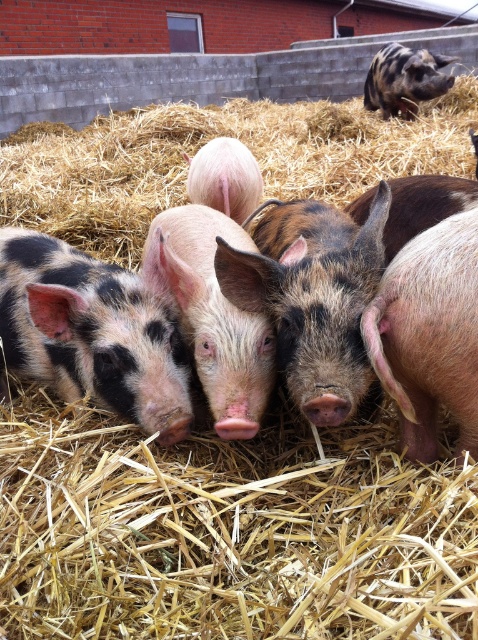
Question: Based on their relative distances, which object is nearer to the speckled pink pig at center?

Choices:
 (A) golden straw at center
 (B) pink soft skin at right

Answer: (B)

Question: Which object is farther from the camera taking this photo?

Choices:
 (A) speckled pink pig at center
 (B) pink soft skin pig at center
 (C) spotted fur piglet at center
 (D) pink soft skin at right

Answer: (C)

Question: Is speckled pink pig at center behind pink matte pig at center?

Choices:
 (A) yes
 (B) no

Answer: (B)

Question: Which object is positioned farthest from the golden straw at center?

Choices:
 (A) pink soft skin at right
 (B) pink matte pig at center
 (C) speckled brown pig at upper right
 (D) spotted fur piglet at center

Answer: (A)

Question: Considering the relative positions of spotted fur piglet at center and pink soft skin pig at center in the image provided, where is spotted fur piglet at center located with respect to pink soft skin pig at center?

Choices:
 (A) right
 (B) left

Answer: (B)

Question: Does pink soft skin pig at center appear on the left side of speckled brown pig at upper right?

Choices:
 (A) no
 (B) yes

Answer: (B)